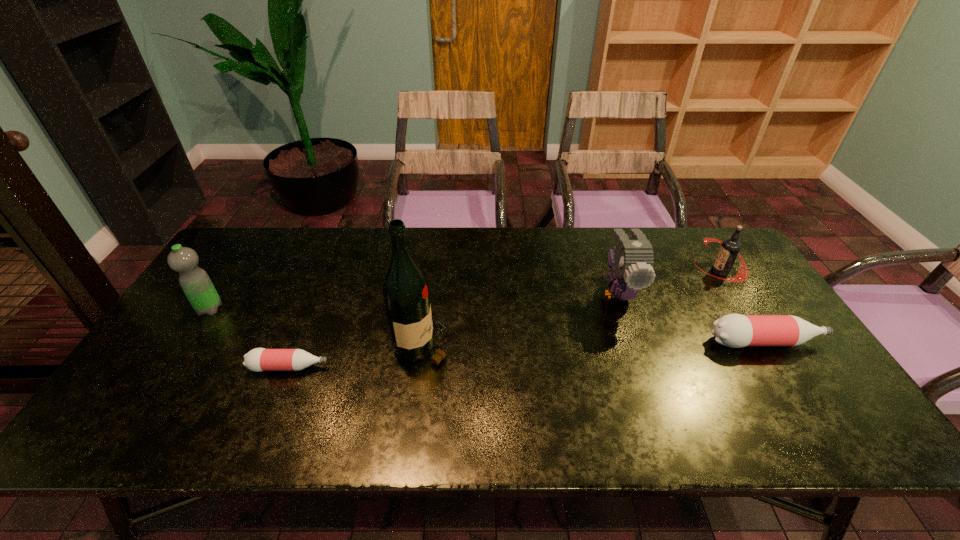
Where is `bottle located at the right edge`? The width and height of the screenshot is (960, 540). bottle located at the right edge is located at coordinates (733, 330).

Image resolution: width=960 pixels, height=540 pixels. Identify the location of root beer that is at the right edge. (730, 247).

Identify the location of object located at the far right corner. (730, 247).

Where is `blank space at the far edge of the desktop`? blank space at the far edge of the desktop is located at coordinates (475, 241).

What are the coordinates of `vacant region at the near edge of the desktop` in the screenshot? It's located at (631, 380).

Locate an element on the screen. vacant space at the left edge of the desktop is located at coordinates (225, 281).

The image size is (960, 540). What are the coordinates of `blank area at the right edge` in the screenshot? It's located at (744, 308).

In the image, there is a desktop. At what (x,y) coordinates should I click in order to perform the action: click on vacant space at the far left corner. Please return your answer as a coordinate pair (x, y). Looking at the image, I should click on (274, 234).

I want to click on vacant space at the near left corner of the desktop, so click(x=124, y=399).

In the image, there is a desktop. At what (x,y) coordinates should I click in order to perform the action: click on free region at the far right corner. Please return your answer as a coordinate pair (x, y). The height and width of the screenshot is (540, 960). Looking at the image, I should click on (701, 261).